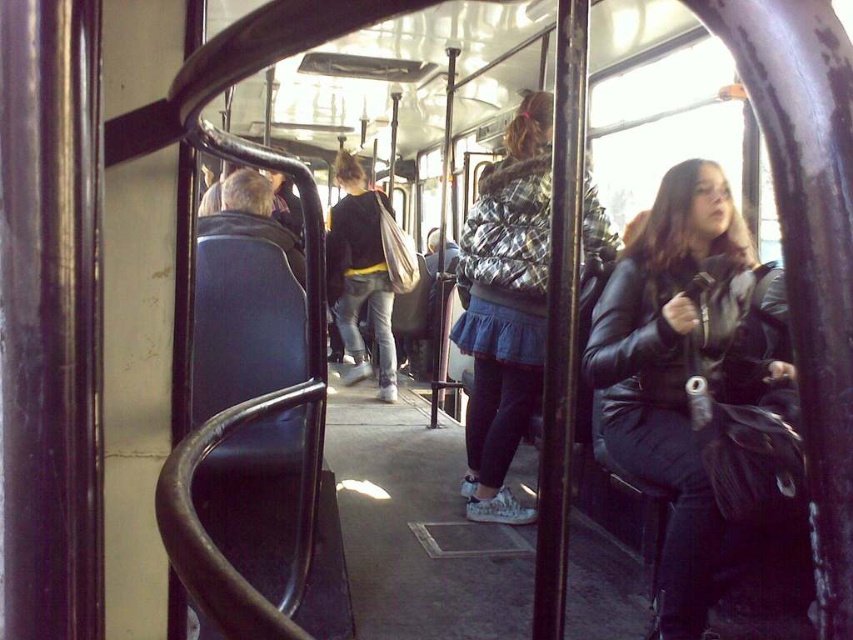
Consider the image. You are a passenger on a public bus and see two people wearing jackets. One is wearing a leather jacket at right and the other is wearing a black leather jacket at center. Which jacket is closer to you?

The leather jacket at right is closer to you than the black leather jacket at center.

You are a passenger on a bus and want to sit down. There is a seat represented by the point at (697, 387). Is this seat currently occupied?

The seat represented by the point at (697, 387) is occupied by the leather jacket at right, so it is currently occupied.

You are a passenger on a public bus and notice two coats at the center of the scene. The plaid fur coat at center and the black leather jacket at center. Which one is closer to the floor?

The plaid fur coat at center is below the black leather jacket at center, so the plaid fur coat at center is closer to the floor.